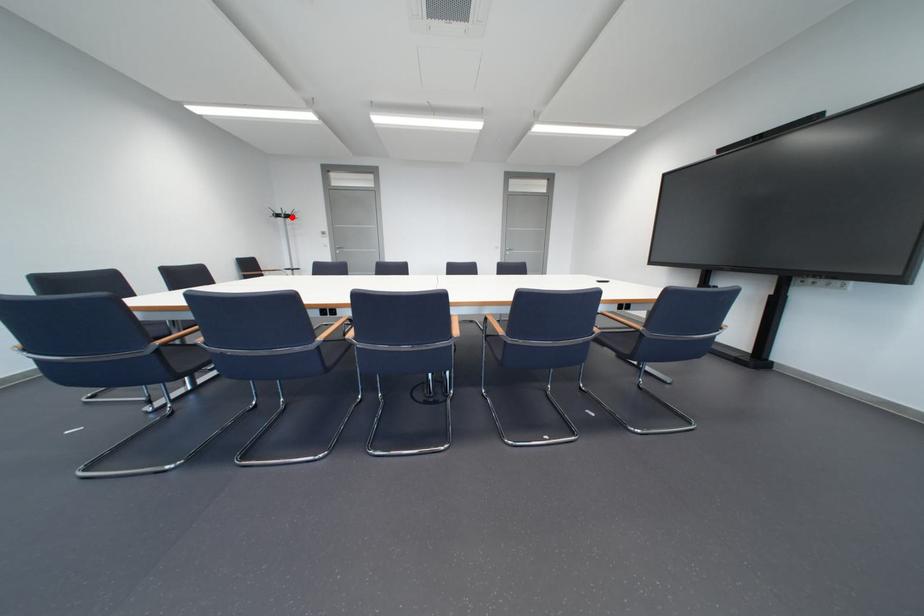
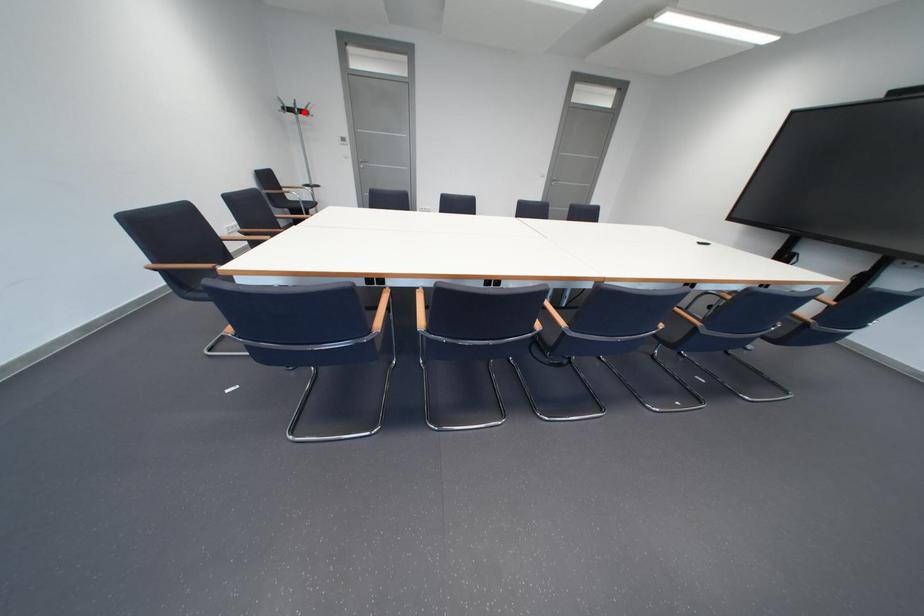
I am providing you with two images of the same scene from different viewpoints. A red point is marked on the first image and another point is marked on the second image. Do the highlighted points in image1 and image2 indicate the same real-world spot?

Yes